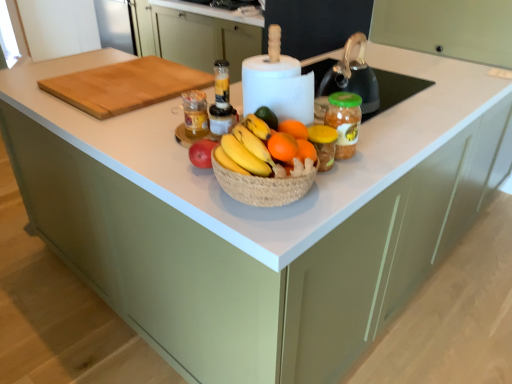
The width and height of the screenshot is (512, 384). What are the coordinates of `vacant area that is in front of green plastic jar at center` in the screenshot? It's located at (351, 181).